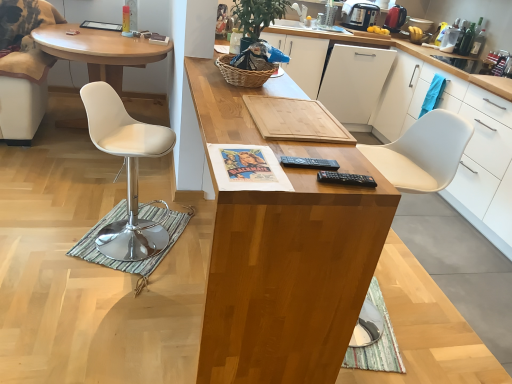
Where is `blank space situated above green striped mat at lower left (from a real-world perspective)`? blank space situated above green striped mat at lower left (from a real-world perspective) is located at coordinates (133, 233).